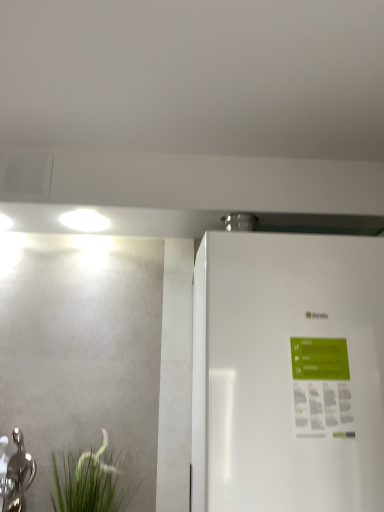
Question: Can you confirm if white glossy refrigerator at right is smaller than silver metallic tap at lower left?

Choices:
 (A) no
 (B) yes

Answer: (A)

Question: Could you tell me if white glossy refrigerator at right is facing silver metallic tap at lower left?

Choices:
 (A) no
 (B) yes

Answer: (A)

Question: Is white glossy refrigerator at right taller than silver metallic tap at lower left?

Choices:
 (A) yes
 (B) no

Answer: (A)

Question: Considering the relative sizes of white glossy refrigerator at right and silver metallic tap at lower left in the image provided, is white glossy refrigerator at right shorter than silver metallic tap at lower left?

Choices:
 (A) yes
 (B) no

Answer: (B)

Question: Does white glossy refrigerator at right have a larger size compared to silver metallic tap at lower left?

Choices:
 (A) no
 (B) yes

Answer: (B)

Question: Is white glossy refrigerator at right positioned behind silver metallic tap at lower left?

Choices:
 (A) no
 (B) yes

Answer: (A)

Question: Does silver metallic tap at lower left appear on the left side of white glossy refrigerator at right?

Choices:
 (A) no
 (B) yes

Answer: (B)

Question: Can you confirm if silver metallic tap at lower left is positioned to the right of white glossy refrigerator at right?

Choices:
 (A) no
 (B) yes

Answer: (A)

Question: Is silver metallic tap at lower left positioned in front of white glossy refrigerator at right?

Choices:
 (A) no
 (B) yes

Answer: (A)

Question: From the image's perspective, is silver metallic tap at lower left on white glossy refrigerator at right?

Choices:
 (A) yes
 (B) no

Answer: (B)

Question: Is silver metallic tap at lower left with white glossy refrigerator at right?

Choices:
 (A) yes
 (B) no

Answer: (B)

Question: Considering the relative sizes of silver metallic tap at lower left and white glossy refrigerator at right in the image provided, is silver metallic tap at lower left bigger than white glossy refrigerator at right?

Choices:
 (A) no
 (B) yes

Answer: (A)

Question: From a real-world perspective, does white glossy refrigerator at right sit lower than green matte plant at lower left?

Choices:
 (A) yes
 (B) no

Answer: (B)